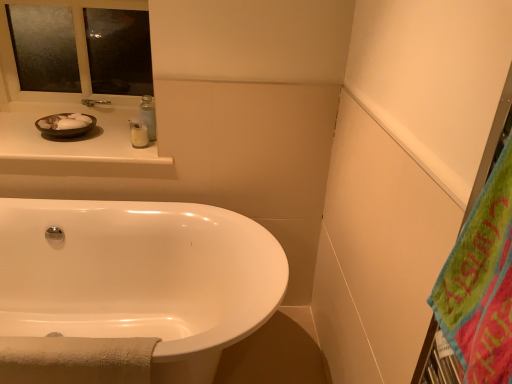
The image size is (512, 384). I want to click on free spot above matte white counter at upper left (from a real-world perspective), so click(x=71, y=141).